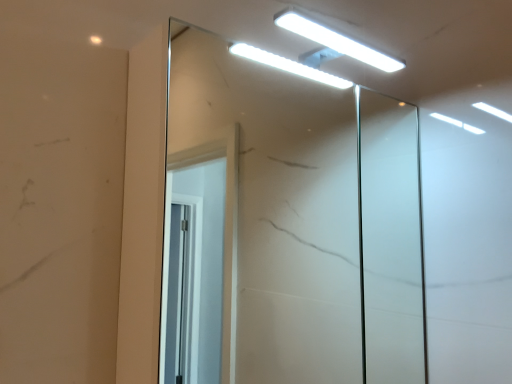
What do you see at coordinates (289, 223) in the screenshot? The width and height of the screenshot is (512, 384). I see `clear glass mirror at center` at bounding box center [289, 223].

The height and width of the screenshot is (384, 512). I want to click on clear glass mirror at center, so click(x=289, y=223).

Measure the distance between point (265,131) and camera.

The depth of point (265,131) is 1.36 meters.

The height and width of the screenshot is (384, 512). What are the coordinates of `clear glass mirror at center` in the screenshot? It's located at (289, 223).